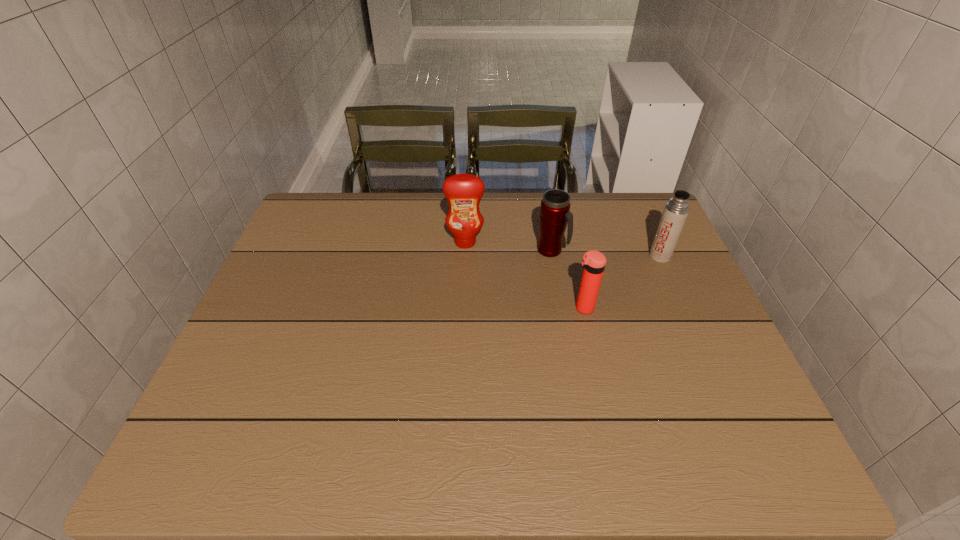
In order to click on condiment in this screenshot , I will do `click(463, 192)`.

Identify the location of the rightmost object. The image size is (960, 540). (676, 211).

Locate an element on the screen. The height and width of the screenshot is (540, 960). the nearest thermos bottle is located at coordinates (594, 262).

Locate an element on the screen. vacant space located 0.230m on the label side of the condiment is located at coordinates (463, 308).

Find the location of a particular element. The image size is (960, 540). blank space located on the back of the rightmost thermos bottle is located at coordinates (637, 205).

Identify the location of vacant area situated on the back of the nearest thermos bottle. This screenshot has width=960, height=540. (565, 228).

At what (x,y) coordinates should I click in order to perform the action: click on object positioned at the far edge. Please return your answer as a coordinate pair (x, y). The width and height of the screenshot is (960, 540). Looking at the image, I should click on (463, 192).

This screenshot has height=540, width=960. Find the location of `object situated at the right edge`. object situated at the right edge is located at coordinates (676, 211).

Identify the location of free space at the far edge of the desktop. Image resolution: width=960 pixels, height=540 pixels. (575, 222).

Locate an element on the screen. The width and height of the screenshot is (960, 540). free spot at the near edge of the desktop is located at coordinates (419, 448).